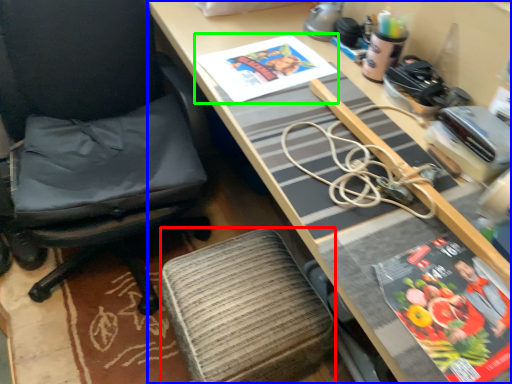
Question: Estimate the real-world distances between objects in this image. Which object is closer to stool (highlighted by a red box), desk (highlighted by a blue box) or book cover (highlighted by a green box)?

Choices:
 (A) desk
 (B) book cover

Answer: (A)